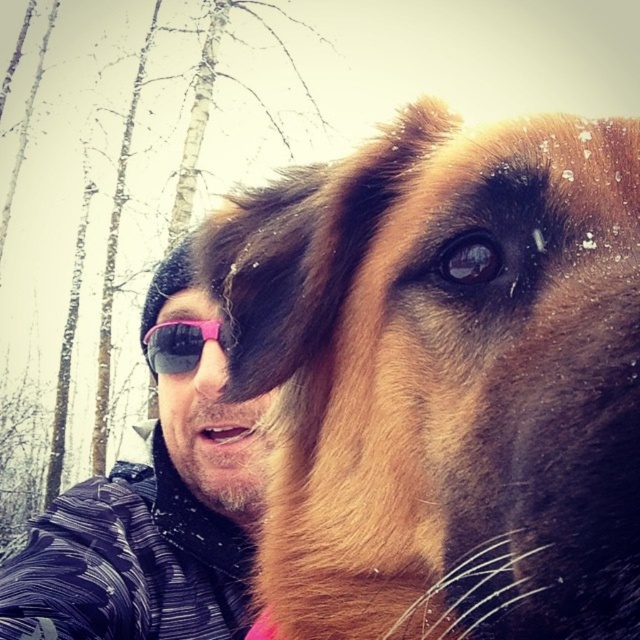
Is point (163, 630) behind point (221, 365)?

That is False.

Does pink reflective sunglasses at center appear under brown fur nose at center?

Indeed, pink reflective sunglasses at center is positioned under brown fur nose at center.

Between point (81, 536) and point (204, 394), which one is positioned behind?

The point (204, 394) is behind.

What are the coordinates of `pink reflective sunglasses at center` in the screenshot? It's located at (148, 536).

Which is more to the right, brown furry dog at center or brown fur nose at center?

From the viewer's perspective, brown furry dog at center appears more on the right side.

Can you confirm if brown furry dog at center is positioned to the right of brown fur nose at center?

Yes, brown furry dog at center is to the right of brown fur nose at center.

Identify the location of brown furry dog at center. (444, 380).

Consider the image. Who is lower down, pink reflective sunglasses at center or pink plastic goggles at center?

pink reflective sunglasses at center

Can you confirm if pink reflective sunglasses at center is bigger than pink plastic goggles at center?

Yes, pink reflective sunglasses at center is bigger than pink plastic goggles at center.

Where is `pink reflective sunglasses at center`? The width and height of the screenshot is (640, 640). pink reflective sunglasses at center is located at coordinates (148, 536).